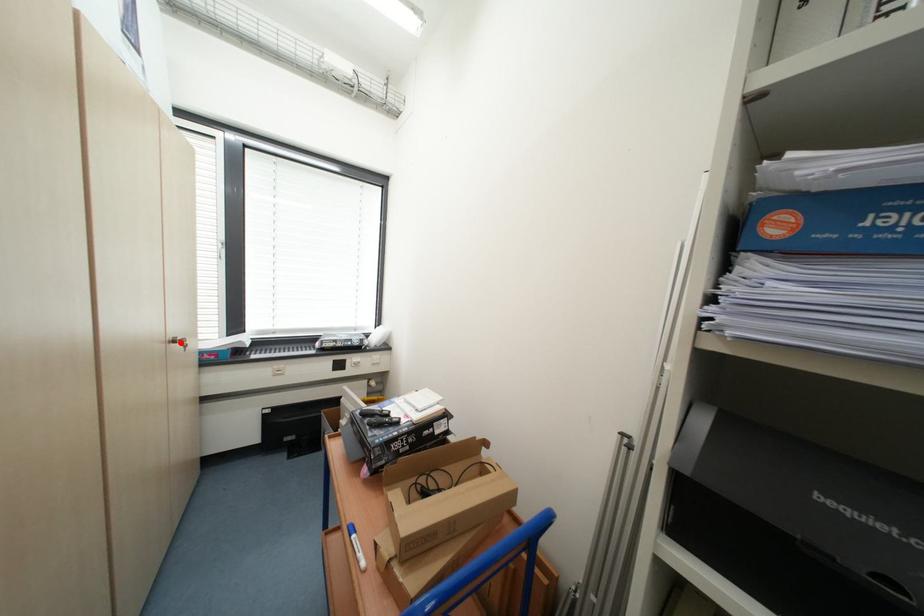
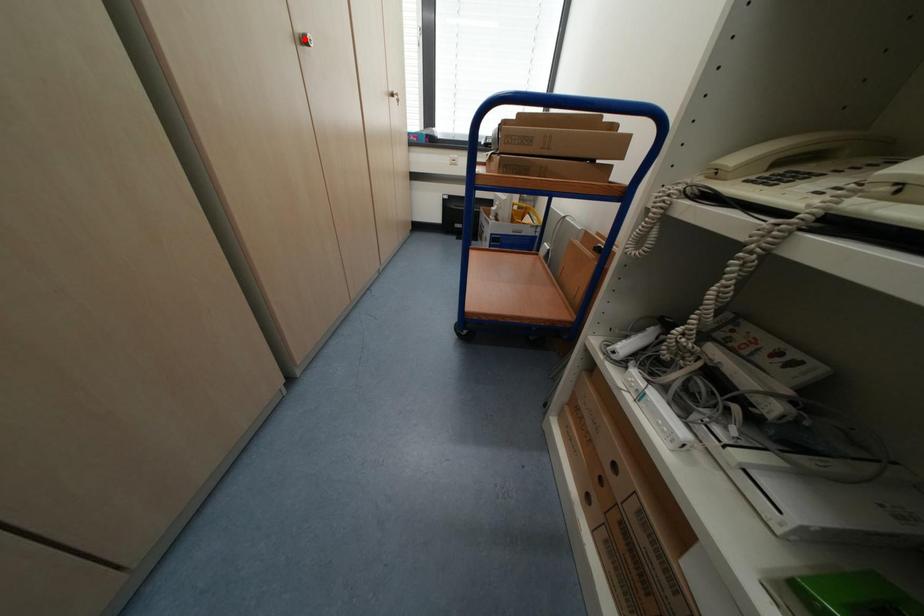
I am providing you with two images of the same scene from different viewpoints. A red point is marked on the first image and another point is marked on the second image. Are the points marked in image1 and image2 representing the same 3D position?

No